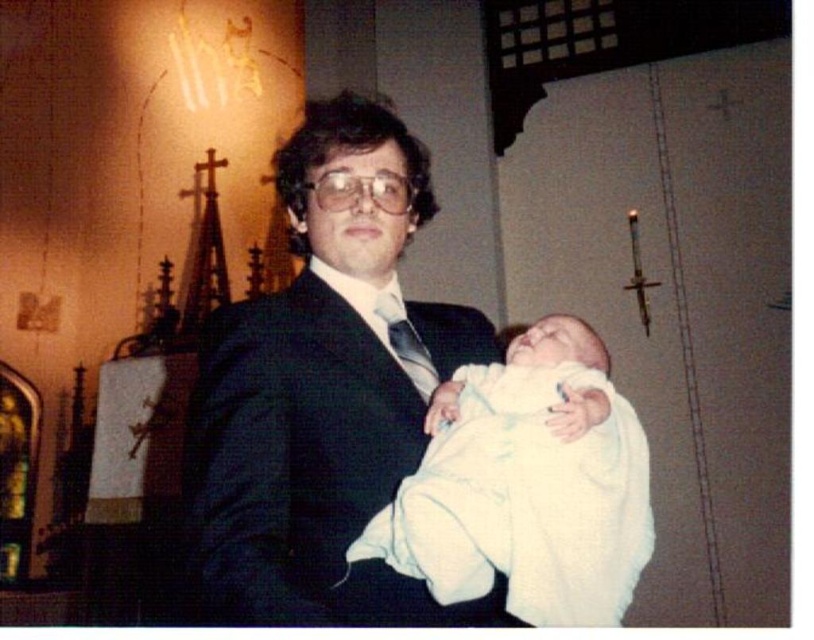
Which is behind, point (239, 480) or point (484, 525)?

Point (239, 480)

Does black satin suit at center appear on the right side of white soft cloth at center?

In fact, black satin suit at center is to the left of white soft cloth at center.

The height and width of the screenshot is (640, 814). Identify the location of black satin suit at center. (322, 394).